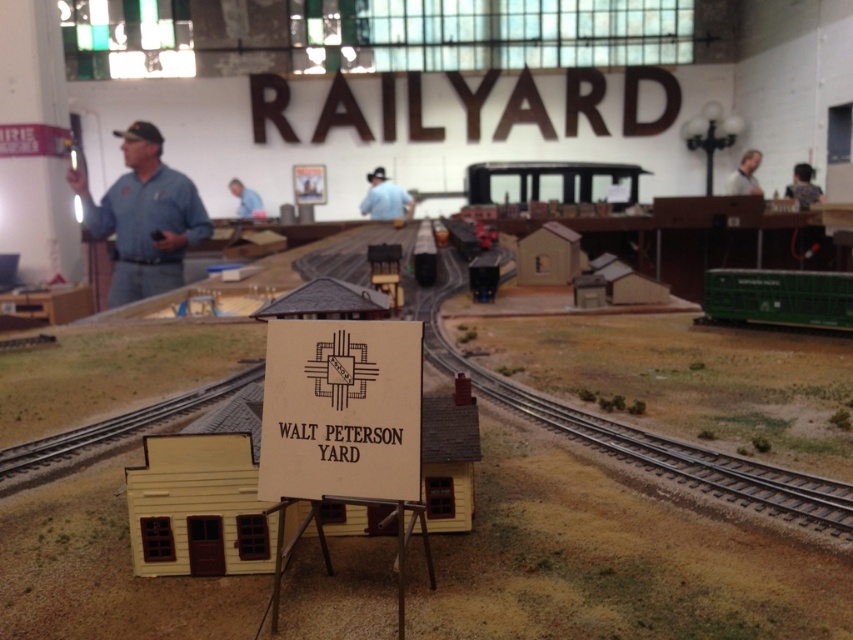
Who is higher up, blue denim shirt at left or blue shirt at upper center?

Positioned higher is blue shirt at upper center.

Is point (199, 212) positioned in front of point (248, 195)?

Yes, point (199, 212) is closer to viewer.

Between point (155, 182) and point (239, 214), which one is positioned behind?

The point (239, 214) is behind.

At what (x,y) coordinates should I click in order to perform the action: click on blue denim shirt at left. Please return your answer as a coordinate pair (x, y). Image resolution: width=853 pixels, height=640 pixels. Looking at the image, I should click on (144, 216).

Is green matte freight car at right closer to the viewer compared to blue uniform at center?

Yes, green matte freight car at right is in front of blue uniform at center.

Is green matte freight car at right smaller than blue uniform at center?

No.

Measure the distance between point [822,326] and camera.

Point [822,326] and camera are 8.04 feet apart.

Locate an element on the screen. The image size is (853, 640). green matte freight car at right is located at coordinates (778, 298).

How far apart are smooth brown hair at upper right and blue shirt at upper center?

smooth brown hair at upper right is 8.66 feet from blue shirt at upper center.

Measure the distance between point (786, 188) and camera.

12.49 feet

Identify the location of smooth brown hair at upper right. (804, 186).

The height and width of the screenshot is (640, 853). I want to click on smooth brown hair at upper right, so click(804, 186).